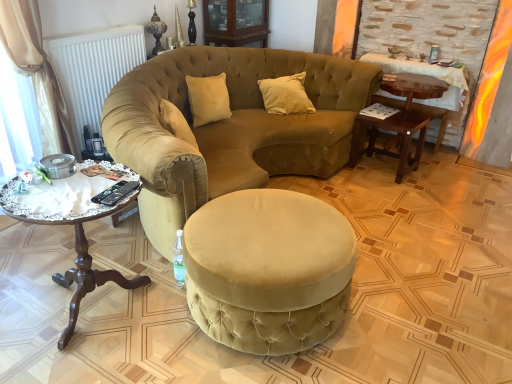
Question: From the image's perspective, would you say velvet beige sofa at center is positioned over woodenwoodencoffee table at left?

Choices:
 (A) yes
 (B) no

Answer: (A)

Question: Considering the relative sizes of velvet beige sofa at center and woodenwoodencoffee table at left in the image provided, is velvet beige sofa at center thinner than woodenwoodencoffee table at left?

Choices:
 (A) yes
 (B) no

Answer: (B)

Question: Considering the relative sizes of velvet beige sofa at center and woodenwoodencoffee table at left in the image provided, is velvet beige sofa at center shorter than woodenwoodencoffee table at left?

Choices:
 (A) no
 (B) yes

Answer: (A)

Question: Considering the relative sizes of velvet beige sofa at center and woodenwoodencoffee table at left in the image provided, is velvet beige sofa at center wider than woodenwoodencoffee table at left?

Choices:
 (A) yes
 (B) no

Answer: (A)

Question: Is velvet beige sofa at center oriented away from woodenwoodencoffee table at left?

Choices:
 (A) yes
 (B) no

Answer: (B)

Question: Can you confirm if velvet beige sofa at center is positioned to the left of woodenwoodencoffee table at left?

Choices:
 (A) yes
 (B) no

Answer: (B)

Question: Is matte wood cabinet at upper center surrounded by wooden table at right?

Choices:
 (A) no
 (B) yes

Answer: (A)

Question: Is wooden table at right turned away from matte wood cabinet at upper center?

Choices:
 (A) yes
 (B) no

Answer: (B)

Question: Can you confirm if wooden table at right is smaller than matte wood cabinet at upper center?

Choices:
 (A) no
 (B) yes

Answer: (A)

Question: From the image's perspective, is wooden table at right on matte wood cabinet at upper center?

Choices:
 (A) yes
 (B) no

Answer: (B)

Question: Considering the relative sizes of wooden table at right and matte wood cabinet at upper center in the image provided, is wooden table at right wider than matte wood cabinet at upper center?

Choices:
 (A) yes
 (B) no

Answer: (B)

Question: Is wooden table at right taller than matte wood cabinet at upper center?

Choices:
 (A) no
 (B) yes

Answer: (B)

Question: From a real-world perspective, is matte wood cabinet at upper center under woodenwoodencoffee table at left?

Choices:
 (A) no
 (B) yes

Answer: (A)